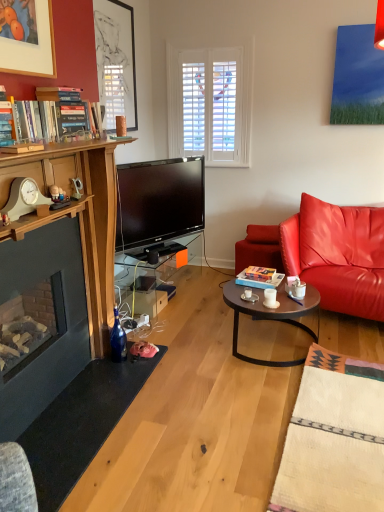
This screenshot has height=512, width=384. I want to click on vacant region to the left of white ceramic mug at center, so click(256, 296).